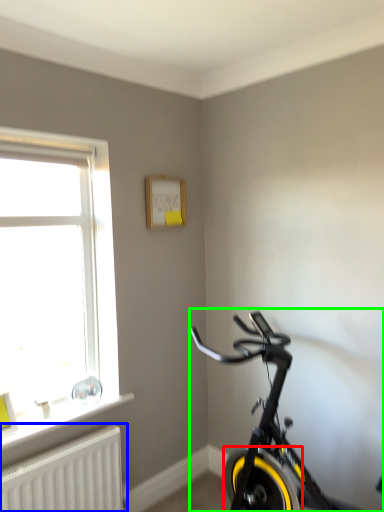
Question: Estimate the real-world distances between objects in this image. Which object is farther from bicycle wheel (highlighted by a red box), radiator (highlighted by a blue box) or bicycle (highlighted by a green box)?

Choices:
 (A) radiator
 (B) bicycle

Answer: (A)